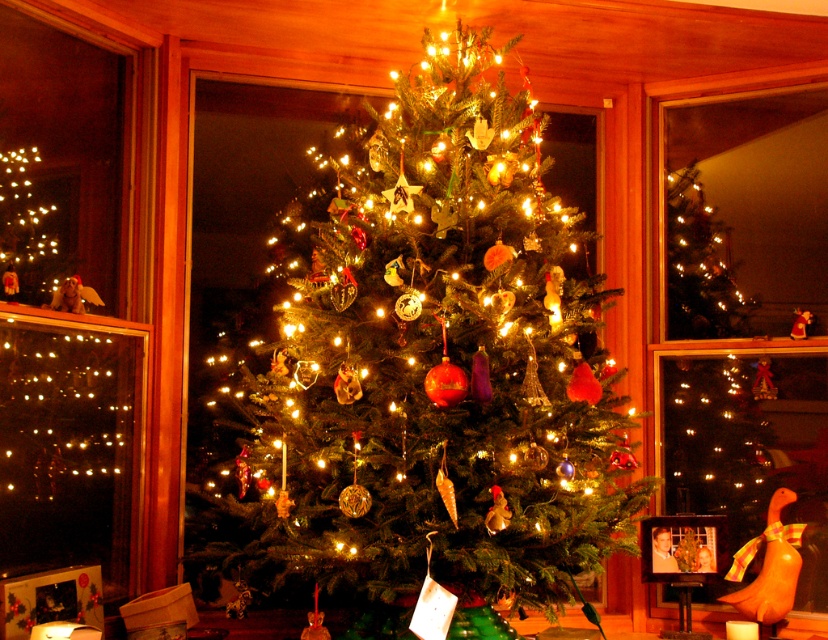
Question: Does green matte christmas tree at center have a greater width compared to clear glass window at upper left?

Choices:
 (A) yes
 (B) no

Answer: (A)

Question: Does green matte christmas tree at center lie in front of clear glass window at upper left?

Choices:
 (A) no
 (B) yes

Answer: (B)

Question: Which point is closer to the camera?

Choices:
 (A) (335, 292)
 (B) (696, 339)

Answer: (A)

Question: Estimate the real-world distances between objects in this image. Which object is farther from the green matte christmas tree at center?

Choices:
 (A) clear glass window at center
 (B) clear glass window at upper left

Answer: (A)

Question: Estimate the real-world distances between objects in this image. Which object is farther from the clear glass window at upper left?

Choices:
 (A) green matte christmas tree at center
 (B) clear glass window at center

Answer: (B)

Question: Can you confirm if green matte christmas tree at center is positioned below clear glass window at upper left?

Choices:
 (A) yes
 (B) no

Answer: (A)